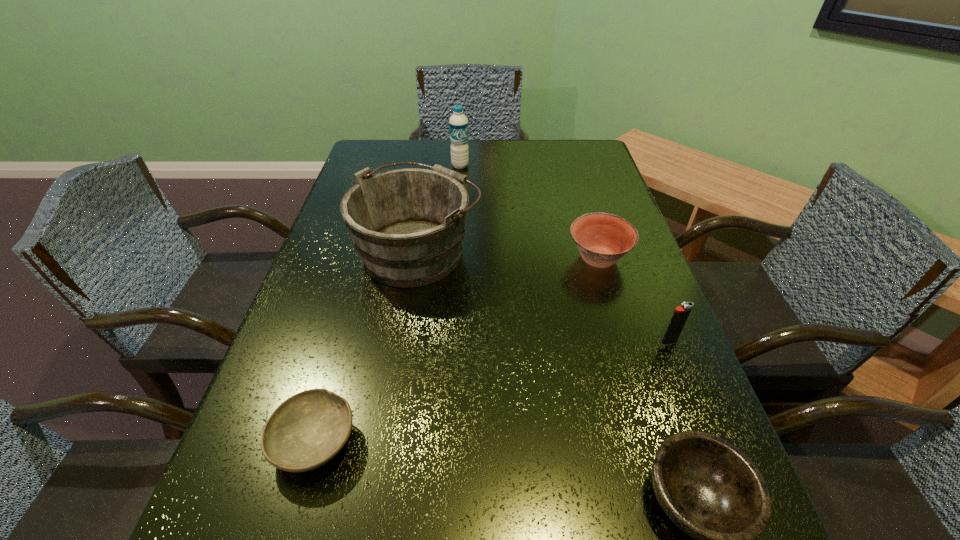
In the image, there is a desktop. At what (x,y) coordinates should I click in order to perform the action: click on vacant space at the right edge. Please return your answer as a coordinate pair (x, y). Looking at the image, I should click on (593, 193).

Identify the location of free space between the leftmost bowl and the wine bucket. The height and width of the screenshot is (540, 960). (367, 346).

Find the location of a particular element. Image resolution: width=960 pixels, height=540 pixels. free space between the fourth tallest object and the igniter is located at coordinates (634, 300).

Where is `unoccupied area between the igniter and the wine bucket`? Image resolution: width=960 pixels, height=540 pixels. unoccupied area between the igniter and the wine bucket is located at coordinates (543, 296).

The image size is (960, 540). Find the location of `vacant region between the fourth farthest object and the wine bucket`. vacant region between the fourth farthest object and the wine bucket is located at coordinates (543, 296).

Where is `vacant area between the fourth tallest object and the farthest object`? The height and width of the screenshot is (540, 960). vacant area between the fourth tallest object and the farthest object is located at coordinates (529, 212).

Where is `free space between the water bottle and the fourth tallest object`? free space between the water bottle and the fourth tallest object is located at coordinates 529,212.

Where is `free space that is in between the farthest bowl and the water bottle`? The image size is (960, 540). free space that is in between the farthest bowl and the water bottle is located at coordinates (529, 212).

The height and width of the screenshot is (540, 960). I want to click on object that is the fifth closest to the igniter, so click(x=458, y=123).

Select which object is the fifth closest to the farthest object. Please provide its 2D coordinates. Your answer should be formatted as a tuple, i.e. [(x, y)], where the tuple contains the x and y coordinates of a point satisfying the conditions above.

[(707, 487)]